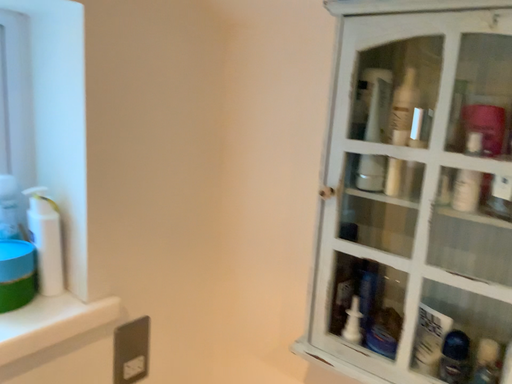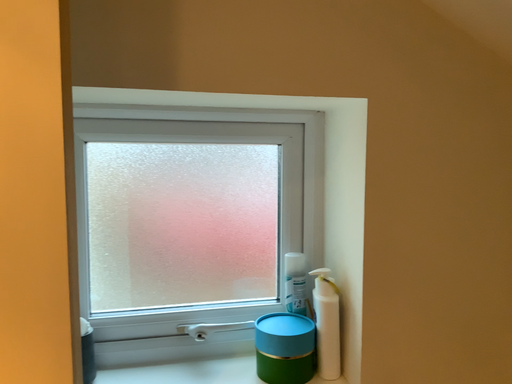
Question: Which way did the camera rotate in the video?

Choices:
 (A) rotated downward
 (B) rotated upward

Answer: (B)